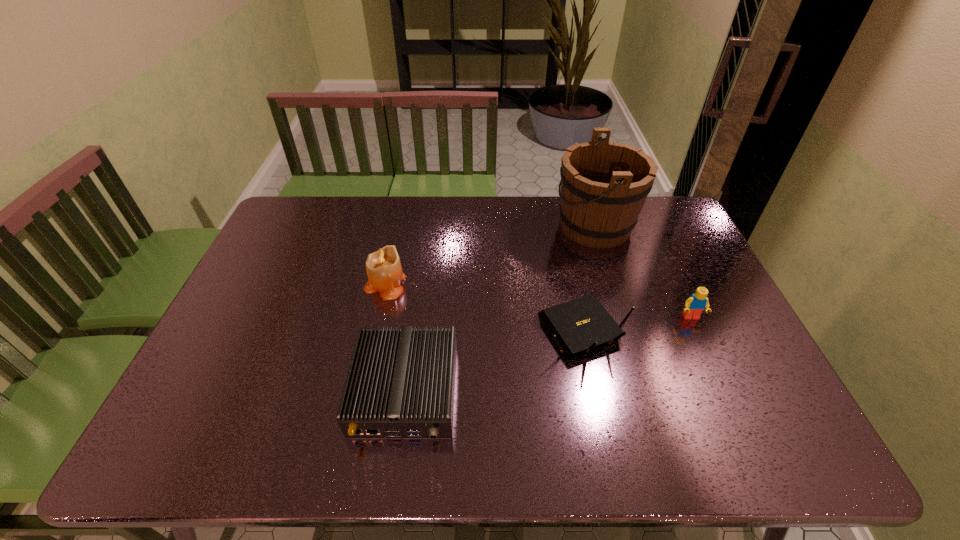
This screenshot has height=540, width=960. Identify the location of the tallest object. (604, 185).

Find the location of a particular element. The width and height of the screenshot is (960, 540). the farthest object is located at coordinates (604, 185).

Locate an element on the screen. the fourth shortest object is located at coordinates (383, 267).

Locate an element on the screen. The height and width of the screenshot is (540, 960). the rightmost object is located at coordinates (697, 302).

The height and width of the screenshot is (540, 960). I want to click on the right router, so click(580, 324).

You are a GUI agent. You are given a task and a screenshot of the screen. Output one action in this format:
    pyautogui.click(x=<x>, y=<y>)
    Task: Click on the left router
    Image resolution: width=960 pixels, height=540 pixels.
    Given the screenshot: What is the action you would take?
    pyautogui.click(x=400, y=383)

This screenshot has height=540, width=960. Identify the location of vacant space positioned on the side of the farthest object with the handle for carrying. (483, 226).

I want to click on vacant space located on the side of the farthest object with the handle for carrying, so click(512, 226).

This screenshot has height=540, width=960. Find the location of `vacant space located on the side of the farthest object with the handle for carrying`. vacant space located on the side of the farthest object with the handle for carrying is located at coordinates pos(506,226).

Find the location of a particular element. vacant area situated on the front of the candle is located at coordinates (377, 317).